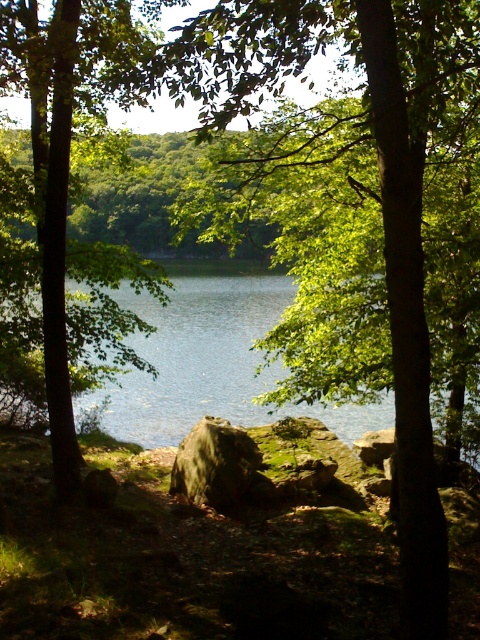
Question: Does green leafy tree at left appear under green mossy rock at center?

Choices:
 (A) yes
 (B) no

Answer: (B)

Question: Is green leafy tree at center to the right of green water at center from the viewer's perspective?

Choices:
 (A) yes
 (B) no

Answer: (A)

Question: Among these points, which one is nearest to the camera?

Choices:
 (A) pyautogui.click(x=263, y=68)
 (B) pyautogui.click(x=207, y=502)
 (C) pyautogui.click(x=133, y=400)
 (D) pyautogui.click(x=46, y=241)

Answer: (D)

Question: Does green leafy tree at center have a greater width compared to green mossy rock at center?

Choices:
 (A) yes
 (B) no

Answer: (A)

Question: Which of the following is the farthest from the observer?

Choices:
 (A) (207, 460)
 (B) (133, 416)
 (C) (13, 304)

Answer: (B)

Question: Which is farther from the green mossy rock at center?

Choices:
 (A) green leafy tree at left
 (B) green water at center

Answer: (B)